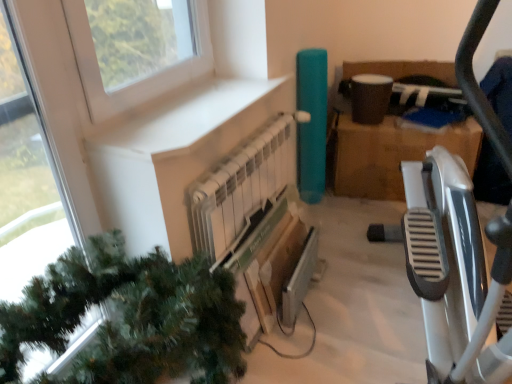
Question: Does white metallic radiator at center touch white matte window sill at upper left?

Choices:
 (A) yes
 (B) no

Answer: (B)

Question: Considering the relative positions of white metallic radiator at center and white matte window sill at upper left in the image provided, is white metallic radiator at center in front of white matte window sill at upper left?

Choices:
 (A) yes
 (B) no

Answer: (B)

Question: Considering the relative sizes of white metallic radiator at center and white matte window sill at upper left in the image provided, is white metallic radiator at center taller than white matte window sill at upper left?

Choices:
 (A) no
 (B) yes

Answer: (B)

Question: Is white matte window sill at upper left at the back of white metallic radiator at center?

Choices:
 (A) no
 (B) yes

Answer: (A)

Question: Does white metallic radiator at center have a smaller size compared to white matte window sill at upper left?

Choices:
 (A) no
 (B) yes

Answer: (A)

Question: Would you say white metallic radiator at center contains white matte window sill at upper left?

Choices:
 (A) yes
 (B) no

Answer: (B)

Question: Is green matte christmas tree at lower left closer to camera compared to white metallic radiator at center?

Choices:
 (A) no
 (B) yes

Answer: (B)

Question: From the image's perspective, would you say green matte christmas tree at lower left is positioned over white metallic radiator at center?

Choices:
 (A) no
 (B) yes

Answer: (A)

Question: Does green matte christmas tree at lower left have a lesser height compared to white metallic radiator at center?

Choices:
 (A) yes
 (B) no

Answer: (A)

Question: Does green matte christmas tree at lower left have a larger size compared to white metallic radiator at center?

Choices:
 (A) yes
 (B) no

Answer: (A)

Question: From a real-world perspective, does green matte christmas tree at lower left sit lower than white metallic radiator at center?

Choices:
 (A) yes
 (B) no

Answer: (A)

Question: Considering the relative sizes of green matte christmas tree at lower left and white metallic radiator at center in the image provided, is green matte christmas tree at lower left thinner than white metallic radiator at center?

Choices:
 (A) yes
 (B) no

Answer: (B)

Question: Can you confirm if transparent glass window at upper left is positioned to the left of white metallic radiator at center?

Choices:
 (A) no
 (B) yes

Answer: (B)